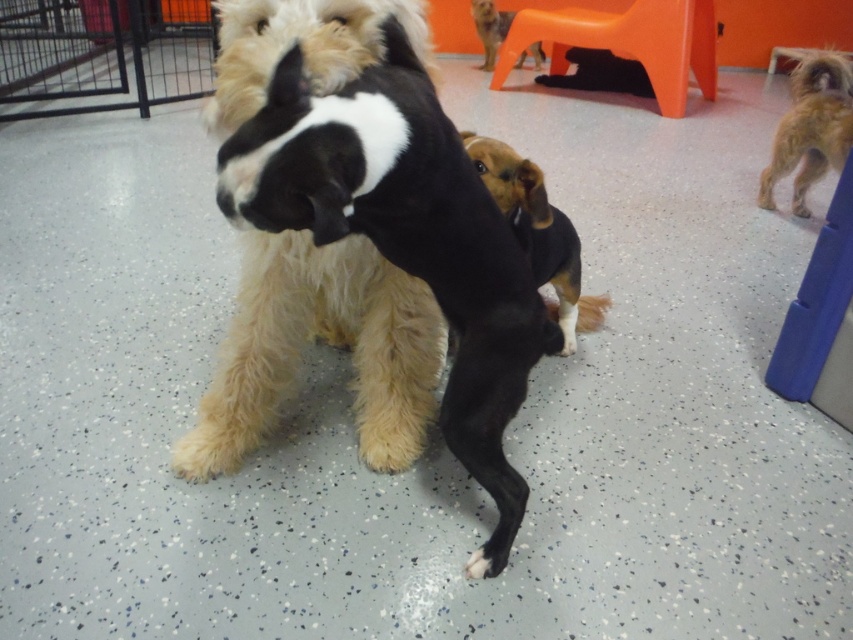
Question: Does shaggy golden dog at right appear under white fur at lower center?

Choices:
 (A) yes
 (B) no

Answer: (B)

Question: Which point is closer to the camera?

Choices:
 (A) click(502, 67)
 (B) click(782, 144)

Answer: (B)

Question: From the image, what is the correct spatial relationship of orange plastic chair at upper right in relation to white fur at lower center?

Choices:
 (A) left
 (B) right

Answer: (B)

Question: Which object is farther from the camera taking this photo?

Choices:
 (A) shaggy golden dog at right
 (B) black and white fur at center
 (C) white fur at lower center

Answer: (A)

Question: Which of the following is the closest to the observer?

Choices:
 (A) orange plastic chair at upper right
 (B) brown furry dog at upper center
 (C) brown furry dog at center

Answer: (C)

Question: Is shaggy golden dog at right below brown furry dog at upper center?

Choices:
 (A) no
 (B) yes

Answer: (B)